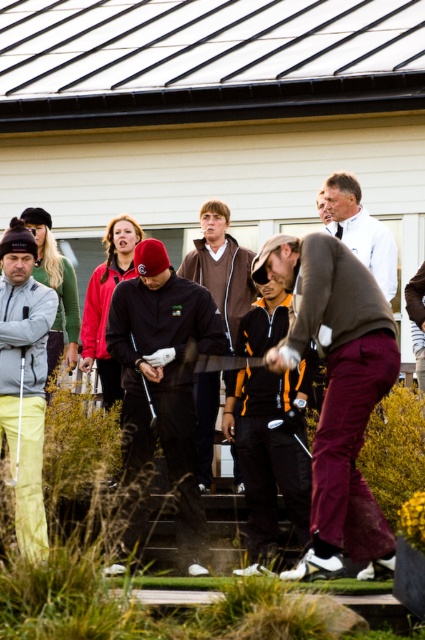
Does dark brown leather jacket at center have a lesser height compared to white shirt at upper center?

Yes, dark brown leather jacket at center is shorter than white shirt at upper center.

Is dark brown leather jacket at center taller than white shirt at upper center?

No, dark brown leather jacket at center is not taller than white shirt at upper center.

I want to click on dark brown leather jacket at center, so click(x=346, y=268).

Find the location of a particular element. The height and width of the screenshot is (640, 425). dark brown leather jacket at center is located at coordinates (346, 268).

Is maroon sweater at center closer to camera compared to black jersey at center?

Yes, it is in front of black jersey at center.

The image size is (425, 640). I want to click on maroon sweater at center, so click(337, 388).

Is black jersey at center thinner than matte black golf club at center?

In fact, black jersey at center might be wider than matte black golf club at center.

Is black jersey at center to the left of matte black golf club at center from the viewer's perspective?

No, black jersey at center is not to the left of matte black golf club at center.

I want to click on black jersey at center, so click(x=269, y=454).

Find the location of `black jersey at center`. black jersey at center is located at coordinates coord(269,454).